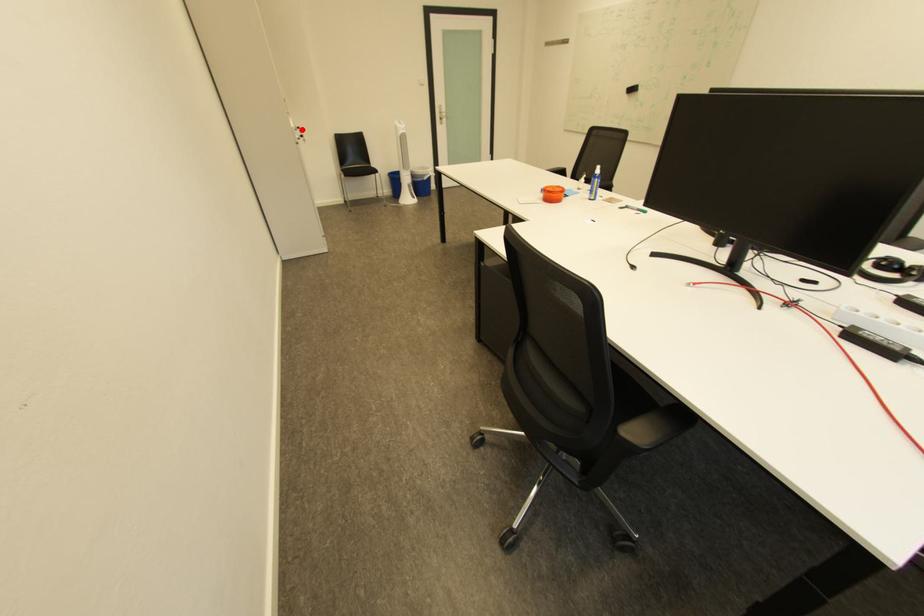
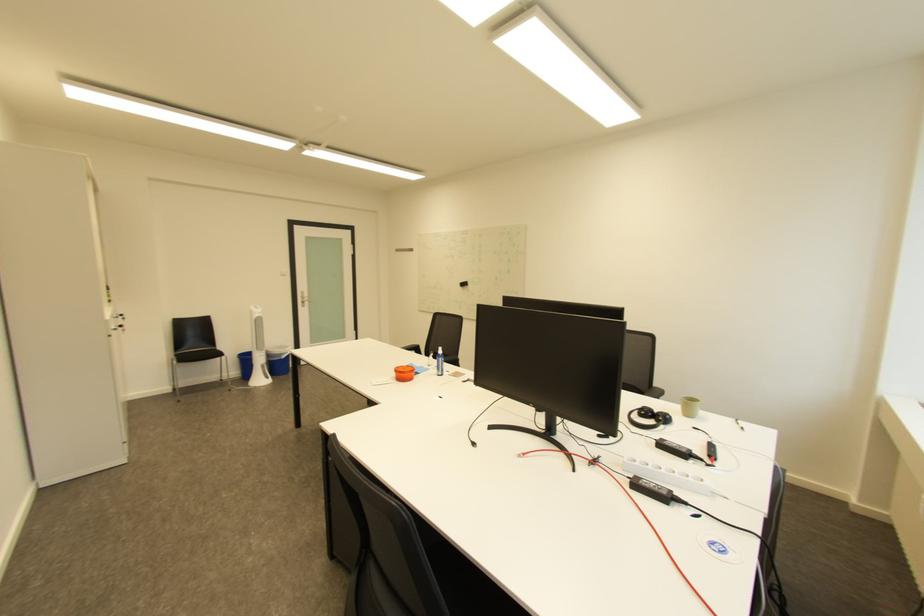
Question: I am providing you with two images of the same scene from different viewpoints. Image1 has a red point marked. In image2, the corresponding 3D location appears at what relative position? Reply with the corresponding letter.

Choices:
 (A) Closer
 (B) Farther

Answer: (B)